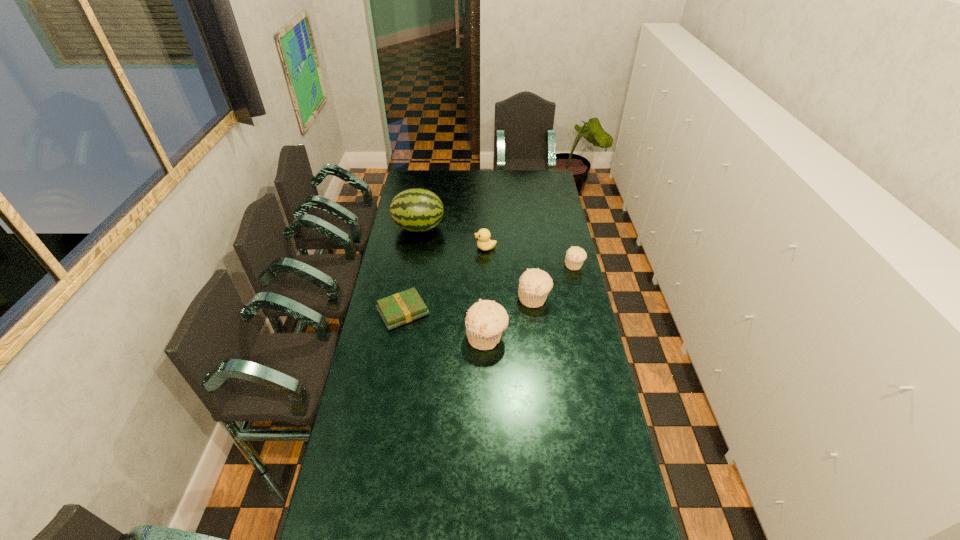
In the image, there is a desktop. In order to click on vacant region at the near edge in this screenshot , I will do `click(384, 519)`.

In the image, there is a desktop. What are the coordinates of `vacant space at the left edge` in the screenshot? It's located at (399, 390).

Find the location of a particular element. This screenshot has height=540, width=960. free space at the right edge of the desktop is located at coordinates (569, 313).

Where is `vacant space at the far left corner`? This screenshot has height=540, width=960. vacant space at the far left corner is located at coordinates (412, 179).

Find the location of a particular element. This screenshot has height=540, width=960. vacant space at the near left corner is located at coordinates (372, 528).

This screenshot has height=540, width=960. I want to click on empty location between the duck and the farthest object, so click(452, 238).

At what (x,y) coordinates should I click in order to perform the action: click on vacant region between the book and the duck. Please return your answer as a coordinate pair (x, y). Looking at the image, I should click on (444, 280).

Where is `free space between the fifth object from left to right and the shortest object`? The width and height of the screenshot is (960, 540). free space between the fifth object from left to right and the shortest object is located at coordinates (468, 305).

This screenshot has width=960, height=540. Identify the location of free space between the second muffin from left to right and the fifth nearest object. (x=510, y=273).

Identify the location of unoccupied area between the duck and the book. (444, 280).